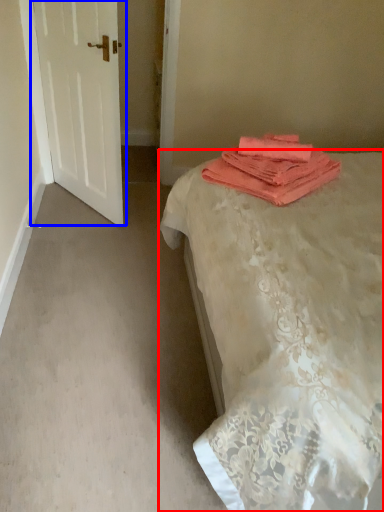
Question: Which of the following is the closest to the observer, bed (highlighted by a red box) or door (highlighted by a blue box)?

Choices:
 (A) bed
 (B) door

Answer: (A)